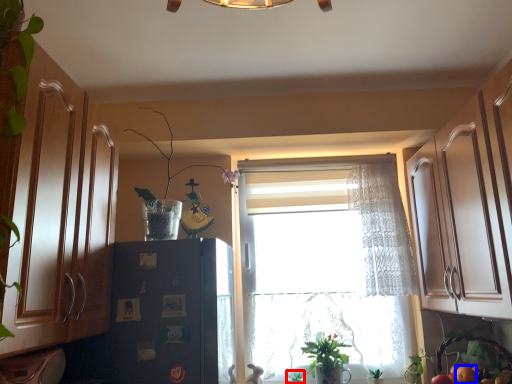
Question: Which object is closer to the camera taking this photo, plant (highlighted by a red box) or fruit (highlighted by a blue box)?

Choices:
 (A) plant
 (B) fruit

Answer: (B)